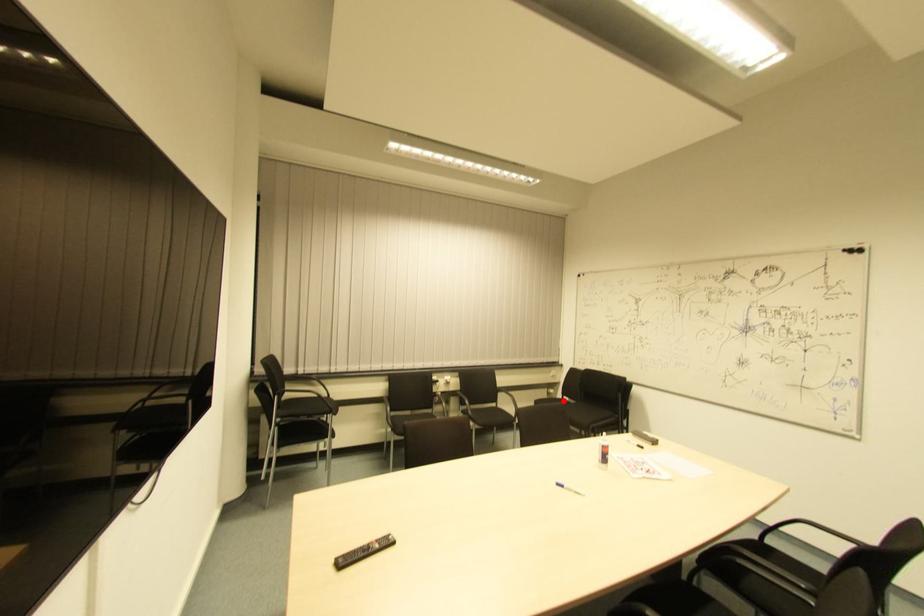
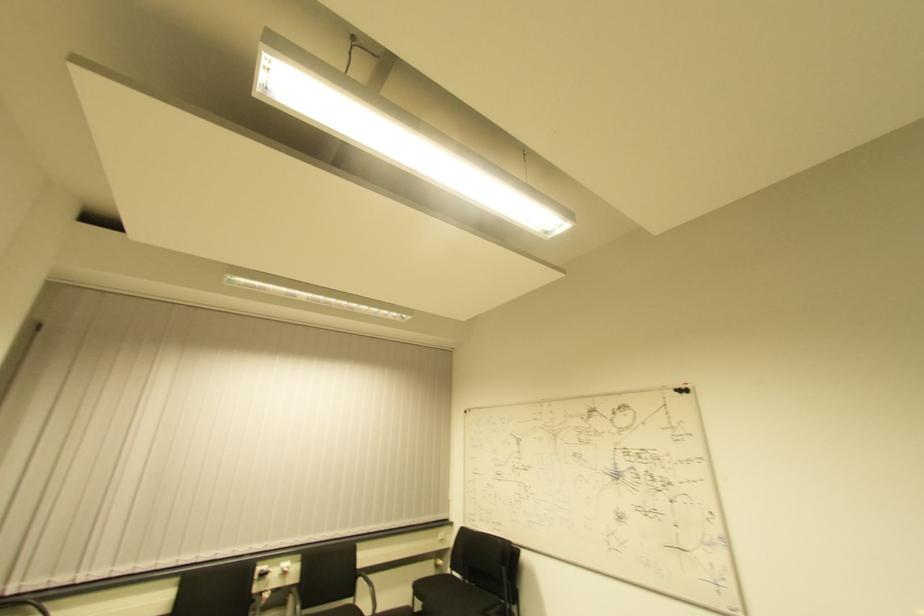
Where in the second image is the point corresponding to the highlighted location from the first image?

(454, 576)